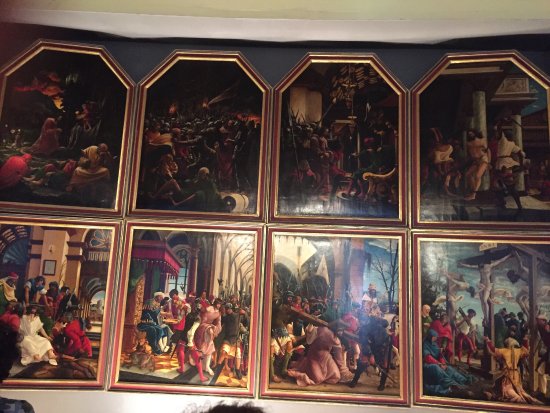
You are a GUI agent. You are given a task and a screenshot of the screen. Output one action in this format:
    pyautogui.click(x=<x>, y=<y>)
    Task: Click on the picture
    
    Given the screenshot: What is the action you would take?
    pyautogui.click(x=380, y=213)